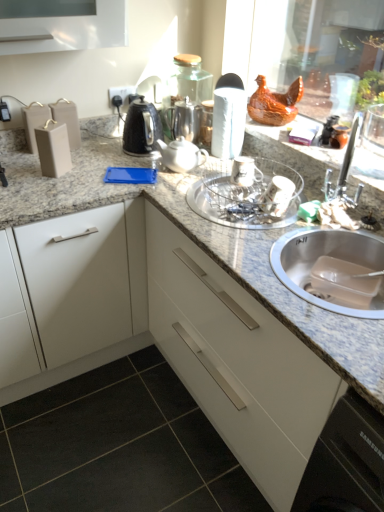
What do you see at coordinates (246, 198) in the screenshot?
I see `clear glass bowl at center` at bounding box center [246, 198].

What do you see at coordinates (237, 362) in the screenshot? The height and width of the screenshot is (512, 384). I see `white matte cabinet at center, marked as the 2th cabinetry in a left-to-right arrangement` at bounding box center [237, 362].

Locate an element on the screen. This screenshot has height=512, width=384. white matte cabinet at center, marked as the 1th cabinetry in a right-to-left arrangement is located at coordinates (237, 362).

Describe the element at coordinates (228, 117) in the screenshot. I see `metallic silver shaker at upper center, marked as the first appliance in a right-to-left arrangement` at that location.

The image size is (384, 512). What do you see at coordinates (141, 129) in the screenshot?
I see `black glossy kettle at center` at bounding box center [141, 129].

Where is `white matte cabinet at left, the 1th cabinetry from the left`? This screenshot has width=384, height=512. white matte cabinet at left, the 1th cabinetry from the left is located at coordinates (81, 292).

In order to click on clear glass bowl at center in this screenshot , I will do `click(246, 198)`.

Considering the positions of point (298, 231) and point (174, 133), is point (298, 231) closer or farther from the camera than point (174, 133)?

Point (298, 231).

How much distance is there between silver metallic sink at lower right and satin silver teapot at center, placed as the first tea pot when sorted from back to front?

They are 30.90 inches apart.

Is satin silver teapot at center, placed as the first tea pot when sorted from back to front, surrounded by silver metallic sink at lower right?

No, satin silver teapot at center, placed as the first tea pot when sorted from back to front, is located outside of silver metallic sink at lower right.

Is silver metallic sink at lower right oriented away from satin silver teapot at center, placed as the first tea pot when sorted from back to front?

No, satin silver teapot at center, placed as the first tea pot when sorted from back to front, is not at the back of silver metallic sink at lower right.

Consider the image. Can you see white matte cabinet at left, marked as the 2th cabinetry in a right-to-left arrangement, touching silver metallic sink at lower right?

No, white matte cabinet at left, marked as the 2th cabinetry in a right-to-left arrangement, is not in contact with silver metallic sink at lower right.

Which point is more distant from viewer, (x=52, y=370) or (x=328, y=260)?

The point (x=52, y=370) is behind.

What's the angular difference between white matte cabinet at left, the 1th cabinetry from the left, and silver metallic sink at lower right's facing directions?

90 degrees separate the facing orientations of white matte cabinet at left, the 1th cabinetry from the left, and silver metallic sink at lower right.

From the picture: Is white matte cabinet at left, the 1th cabinetry from the left, inside silver metallic sink at lower right?

That's incorrect, white matte cabinet at left, the 1th cabinetry from the left, is not inside silver metallic sink at lower right.

Is point (371, 300) farther from viewer compared to point (100, 232)?

No, (371, 300) is closer to viewer.

Does silver metallic sink at lower right have a lesser width compared to white matte cabinet at left, the 1th cabinetry from the left?

Correct, the width of silver metallic sink at lower right is less than that of white matte cabinet at left, the 1th cabinetry from the left.

Is silver metallic sink at lower right beside white matte cabinet at left, marked as the 2th cabinetry in a right-to-left arrangement?

silver metallic sink at lower right and white matte cabinet at left, marked as the 2th cabinetry in a right-to-left arrangement, are not in contact.

Based on the photo, looking at the image, does white matte cabinet at left, marked as the 2th cabinetry in a right-to-left arrangement, seem bigger or smaller compared to satin silver teapot at center, placed as the first tea pot when sorted from back to front?

In the image, white matte cabinet at left, marked as the 2th cabinetry in a right-to-left arrangement, appears to be larger than satin silver teapot at center, placed as the first tea pot when sorted from back to front.

Could you tell me if white matte cabinet at left, marked as the 2th cabinetry in a right-to-left arrangement, is facing satin silver teapot at center, placed as the first tea pot when sorted from back to front?

No, white matte cabinet at left, marked as the 2th cabinetry in a right-to-left arrangement, is not oriented towards satin silver teapot at center, placed as the first tea pot when sorted from back to front.

Which object is thinner, white matte cabinet at left, marked as the 2th cabinetry in a right-to-left arrangement, or satin silver teapot at center, placed as the first tea pot when sorted from back to front?

satin silver teapot at center, placed as the first tea pot when sorted from back to front, is thinner.

Is white matte cabinet at left, marked as the 2th cabinetry in a right-to-left arrangement, touching satin silver teapot at center, placed as the first tea pot when sorted from back to front?

No, white matte cabinet at left, marked as the 2th cabinetry in a right-to-left arrangement, is not next to satin silver teapot at center, placed as the first tea pot when sorted from back to front.

Is silver metallic sink at lower right oriented away from white glossy teapot at center, which is counted as the second tea pot, starting from the back?

silver metallic sink at lower right is not turned away from white glossy teapot at center, which is counted as the second tea pot, starting from the back.

Is point (357, 297) in front of point (163, 147)?

Yes.

Could white glossy teapot at center, which is counted as the second tea pot, starting from the back, be considered to be inside silver metallic sink at lower right?

No, white glossy teapot at center, which is counted as the second tea pot, starting from the back, is not a part of silver metallic sink at lower right.

Is silver metallic sink at lower right further to camera compared to white glossy teapot at center, which is counted as the second tea pot, starting from the back?

No, the depth of silver metallic sink at lower right is less than that of white glossy teapot at center, which is counted as the second tea pot, starting from the back.

In the scene shown: From the image's perspective, is white matte cabinet at left, the 1th cabinetry from the left, above white glossy teapot at center, which is counted as the second tea pot, starting from the back?

No, from the image's perspective, white matte cabinet at left, the 1th cabinetry from the left, is not over white glossy teapot at center, which is counted as the second tea pot, starting from the back.

Is point (95, 265) farther from viewer compared to point (176, 168)?

Yes, it is behind point (176, 168).

Considering the relative sizes of white matte cabinet at left, marked as the 2th cabinetry in a right-to-left arrangement, and white glossy teapot at center, which is counted as the second tea pot, starting from the back, in the image provided, is white matte cabinet at left, marked as the 2th cabinetry in a right-to-left arrangement, wider than white glossy teapot at center, which is counted as the second tea pot, starting from the back,?

Indeed, white matte cabinet at left, marked as the 2th cabinetry in a right-to-left arrangement, has a greater width compared to white glossy teapot at center, which is counted as the second tea pot, starting from the back.

From the image's perspective, between clear glass bowl at center and black glossy kettle at center, which one is located above?

black glossy kettle at center is shown above in the image.

From a real-world perspective, is clear glass bowl at center located higher than black glossy kettle at center?

Actually, clear glass bowl at center is physically below black glossy kettle at center in the real world.

Is clear glass bowl at center further to camera compared to black glossy kettle at center?

No, it is in front of black glossy kettle at center.

Find the location of a particular element. This screenshot has width=384, height=512. kitchen appliance behind the clear glass bowl at center is located at coordinates (141, 129).

This screenshot has width=384, height=512. In order to click on the 2nd tea pot behind the silver metallic sink at lower right, starting your count from the anchor in this screenshot , I will do `click(184, 119)`.

The height and width of the screenshot is (512, 384). I want to click on sink in front of the white matte cabinet at left, marked as the 2th cabinetry in a right-to-left arrangement, so click(x=333, y=269).

From the image, which object appears to be farther from white matte cabinet at center, marked as the 2th cabinetry in a left-to-right arrangement, silver metallic sink at lower right or white matte cabinet at left, marked as the 2th cabinetry in a right-to-left arrangement?

white matte cabinet at left, marked as the 2th cabinetry in a right-to-left arrangement, lies further to white matte cabinet at center, marked as the 2th cabinetry in a left-to-right arrangement, than the other object.

Looking at the image, which one is located closer to clear glass bowl at center, silver metallic sink at lower right or white matte cabinet at left, the 1th cabinetry from the left?

Based on the image, silver metallic sink at lower right appears to be nearer to clear glass bowl at center.

Looking at the image, which one is located further to matte gray box at left, which is the 1th appliance from left to right, white matte cabinet at left, the 1th cabinetry from the left, or clear glass bowl at center?

clear glass bowl at center is positioned further to the anchor matte gray box at left, which is the 1th appliance from left to right.

Looking at the image, which one is located further to white matte cabinet at left, the 1th cabinetry from the left, satin silver teapot at center, positioned as the 2th tea pot in front-to-back order, or white matte cabinet at center, marked as the 1th cabinetry in a right-to-left arrangement?

satin silver teapot at center, positioned as the 2th tea pot in front-to-back order, lies further to white matte cabinet at left, the 1th cabinetry from the left, than the other object.

Which object lies further to the anchor point matte gray box at left, marked as the 2th appliance in a right-to-left arrangement, satin silver teapot at center, placed as the first tea pot when sorted from back to front, or clear glass bowl at center?

clear glass bowl at center is further to matte gray box at left, marked as the 2th appliance in a right-to-left arrangement.

Considering their positions, is white matte cabinet at center, marked as the 2th cabinetry in a left-to-right arrangement, positioned closer to satin silver teapot at center, placed as the first tea pot when sorted from back to front, than white matte cabinet at left, the 1th cabinetry from the left?

white matte cabinet at left, the 1th cabinetry from the left, lies closer to satin silver teapot at center, placed as the first tea pot when sorted from back to front, than the other object.

Considering their positions, is white glossy teapot at center, which is counted as the second tea pot, starting from the back, positioned closer to clear glass bowl at center than silver metallic sink at lower right?

The object closer to clear glass bowl at center is silver metallic sink at lower right.

Which object lies further to the anchor point satin silver teapot at center, positioned as the 2th tea pot in front-to-back order, metallic silver shaker at upper center, which ranks as the second appliance in left-to-right order, or white matte cabinet at center, marked as the 1th cabinetry in a right-to-left arrangement?

white matte cabinet at center, marked as the 1th cabinetry in a right-to-left arrangement.

Identify the location of kitchen appliance between white matte cabinet at left, the 1th cabinetry from the left, and silver metallic sink at lower right, in the horizontal direction. Image resolution: width=384 pixels, height=512 pixels. (141, 129).

Identify the location of kitchen appliance located between matte gray box at left, marked as the 2th appliance in a right-to-left arrangement, and satin silver teapot at center, positioned as the 2th tea pot in front-to-back order, in the left-right direction. (141, 129).

The width and height of the screenshot is (384, 512). Find the location of `glass bowl situated between matte gray box at left, which is the 1th appliance from left to right, and silver metallic sink at lower right from left to right`. glass bowl situated between matte gray box at left, which is the 1th appliance from left to right, and silver metallic sink at lower right from left to right is located at coordinates (246, 198).

The height and width of the screenshot is (512, 384). What are the coordinates of `appliance between matte gray box at left, marked as the 2th appliance in a right-to-left arrangement, and clear glass bowl at center` in the screenshot? It's located at (228, 117).